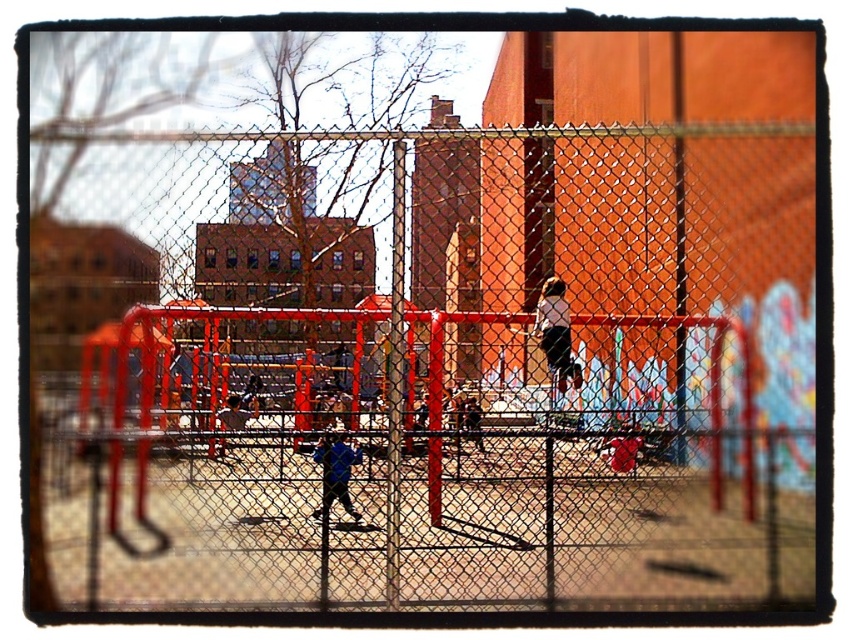
Which is more to the left, metal mesh fence at center or blue fabric jacket at center?

blue fabric jacket at center is more to the left.

Does metal mesh fence at center lie in front of blue fabric jacket at center?

That is True.

Who is more distant from viewer, (277, 497) or (329, 465)?

Point (329, 465)

I want to click on metal mesh fence at center, so click(x=445, y=392).

Is metal mesh fence at center taller than white matte shirt at upper center?

Yes.

Does metal mesh fence at center have a greater width compared to white matte shirt at upper center?

Correct, the width of metal mesh fence at center exceeds that of white matte shirt at upper center.

Is point (254, 513) positioned in front of point (544, 342)?

Yes, it is in front of point (544, 342).

Locate an element on the screen. The width and height of the screenshot is (853, 640). metal mesh fence at center is located at coordinates (445, 392).

Describe the element at coordinates (556, 332) in the screenshot. I see `white matte shirt at upper center` at that location.

Is point (567, 330) positioned after point (334, 458)?

Yes, it is behind point (334, 458).

Find the location of `white matte shirt at upper center`. white matte shirt at upper center is located at coordinates (556, 332).